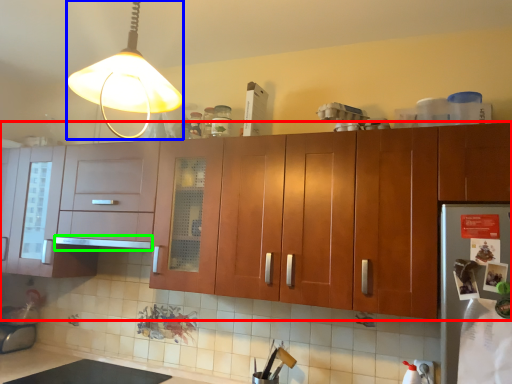
Question: Considering the real-world distances, which object is farthest from cabinetry (highlighted by a red box)? lamp (highlighted by a blue box) or exhaust hood (highlighted by a green box)?

Choices:
 (A) lamp
 (B) exhaust hood

Answer: (A)